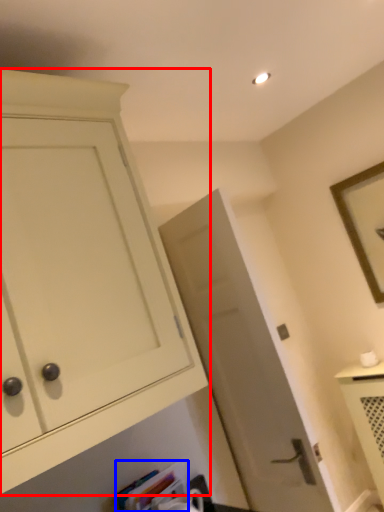
Question: Which object appears closest to the camera in this image, cabinetry (highlighted by a red box) or book (highlighted by a blue box)?

Choices:
 (A) cabinetry
 (B) book

Answer: (A)